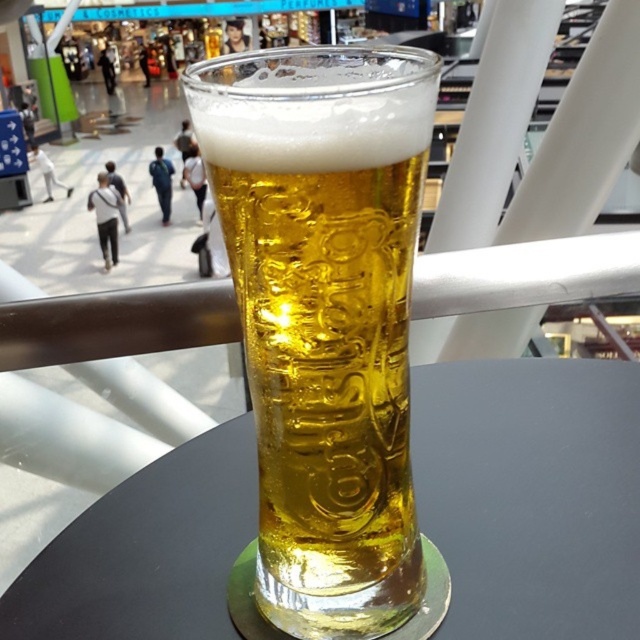
Question: Can you confirm if translucent glass beer at center is wider than transparent glass at center?

Choices:
 (A) no
 (B) yes

Answer: (A)

Question: Is translucent glass beer at center further to camera compared to transparent glass at center?

Choices:
 (A) no
 (B) yes

Answer: (A)

Question: Is translucent glass beer at center wider than transparent glass at center?

Choices:
 (A) no
 (B) yes

Answer: (A)

Question: Which point is farther to the camera?

Choices:
 (A) (493, 627)
 (B) (376, 236)

Answer: (A)

Question: Which point is closer to the camera?

Choices:
 (A) (563, 444)
 (B) (320, 616)

Answer: (B)